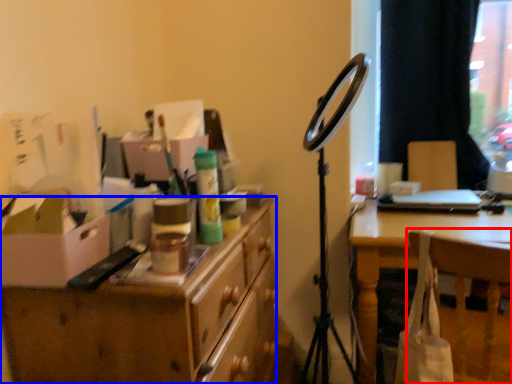
Question: Which object is closer to the camera taking this photo, chair (highlighted by a red box) or desk (highlighted by a blue box)?

Choices:
 (A) chair
 (B) desk

Answer: (B)